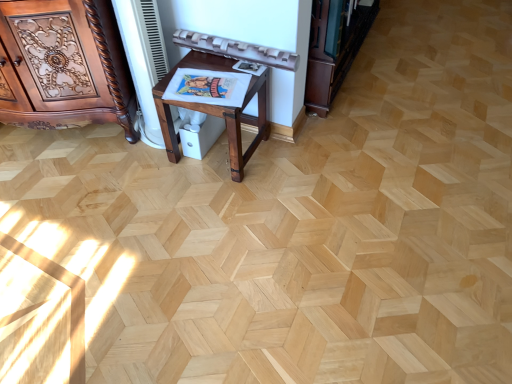
Locate an element on the screen. The height and width of the screenshot is (384, 512). vacant area that is in front of polished wood cabinet at left is located at coordinates (65, 198).